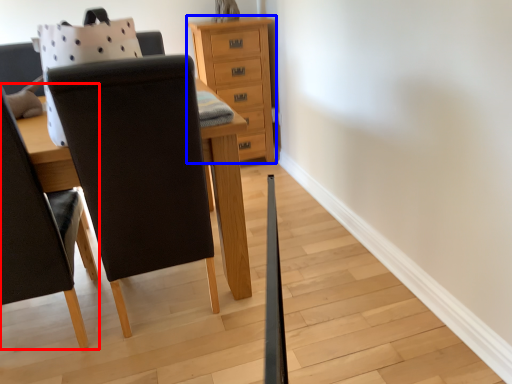
Question: Which object is further to the camera taking this photo, chair (highlighted by a red box) or chest of drawers (highlighted by a blue box)?

Choices:
 (A) chair
 (B) chest of drawers

Answer: (B)